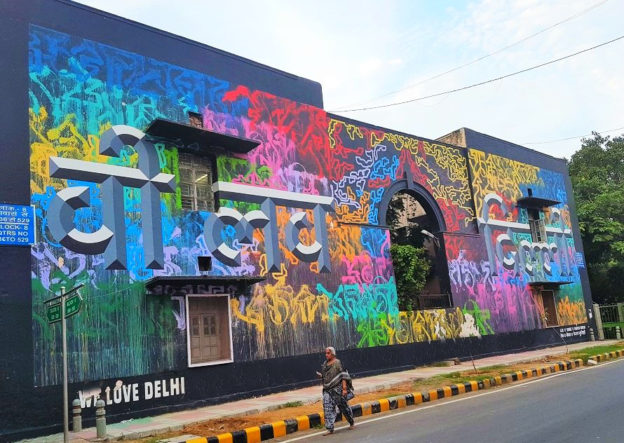
You are a GUI agent. You are given a task and a screenshot of the screen. Output one action in this format:
    pyautogui.click(x=<x>, y=<y>)
    Task: Click on the open window
    This screenshot has height=443, width=624.
    Given the screenshot: What is the action you would take?
    pyautogui.click(x=538, y=233)